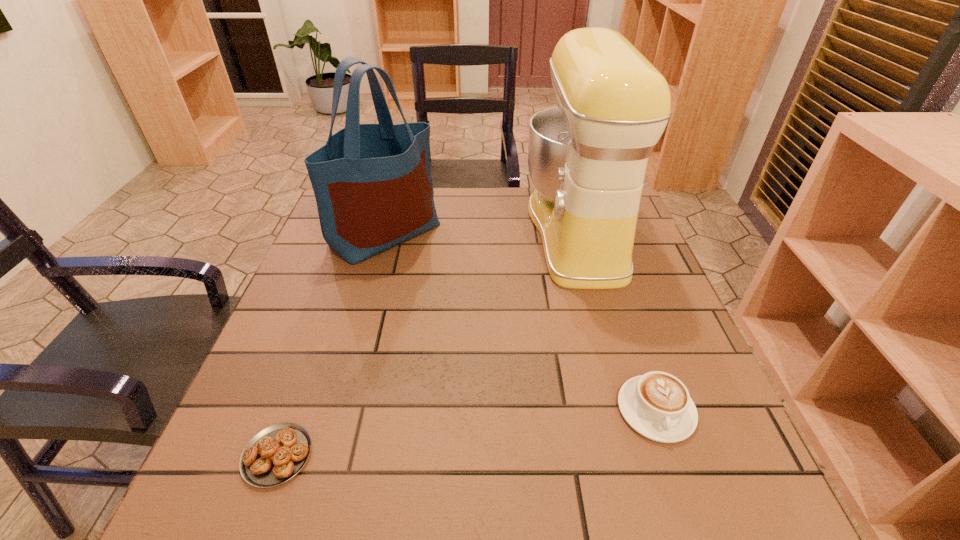
At what (x,y) coordinates should I click in order to perform the action: click on free space at the far edge of the desktop. Please return your answer as a coordinate pair (x, y). The image size is (960, 540). Looking at the image, I should click on (444, 199).

The height and width of the screenshot is (540, 960). I want to click on vacant region at the near edge of the desktop, so click(x=403, y=494).

Identify the location of blank space at the left edge. This screenshot has width=960, height=540. (337, 319).

In the image, there is a desktop. Identify the location of free region at the right edge. The height and width of the screenshot is (540, 960). pyautogui.click(x=637, y=273).

This screenshot has height=540, width=960. I want to click on empty space that is in between the mixer and the handbag, so click(x=482, y=233).

Where is `free spot between the mixer and the pastry`? free spot between the mixer and the pastry is located at coordinates (427, 344).

Where is `free point between the third tallest object and the shortest object`? The width and height of the screenshot is (960, 540). free point between the third tallest object and the shortest object is located at coordinates (467, 433).

You are a GUI agent. You are given a task and a screenshot of the screen. Output one action in this format:
    pyautogui.click(x=<x>, y=<y>)
    Task: Click on the free space between the shortest object and the handbag
    
    Given the screenshot: What is the action you would take?
    [331, 344]

I want to click on free space between the handbag and the shortest object, so click(x=331, y=344).

This screenshot has width=960, height=540. Find the location of `vacant space that is in between the second shortest object and the handbag`. vacant space that is in between the second shortest object and the handbag is located at coordinates (521, 321).